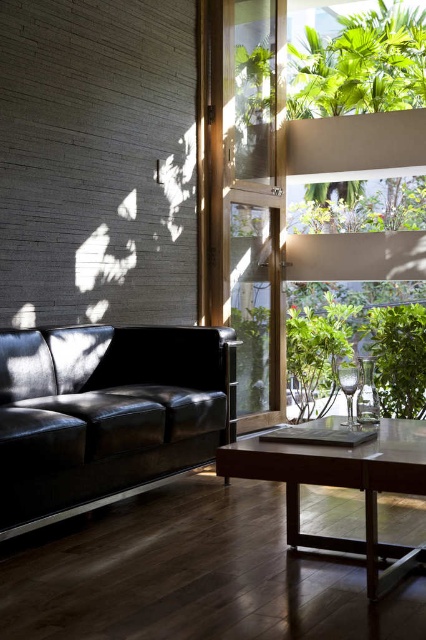
Can you confirm if glossy wood table at center is smaller than green leafy plant at right?

Actually, glossy wood table at center might be larger than green leafy plant at right.

This screenshot has height=640, width=426. What are the coordinates of `glossy wood table at center` in the screenshot? It's located at (344, 486).

Is point (394, 576) positioned after point (377, 310)?

No, (394, 576) is closer to viewer.

The image size is (426, 640). I want to click on glossy wood table at center, so click(344, 486).

Is matte black leather couch at left positioned at the back of green leafy plant at right?

No, matte black leather couch at left is closer to the viewer.

Does matte black leather couch at left appear over green leafy plant at right?

Yes.

Who is more forward, (80,464) or (402,316)?

Point (80,464)

The image size is (426, 640). What are the coordinates of `matte black leather couch at left` in the screenshot? It's located at (106, 413).

Consider the image. Can you confirm if green leafy plant at center is wider than green leafy plant at right?

Correct, the width of green leafy plant at center exceeds that of green leafy plant at right.

Does point (305, 392) come closer to viewer compared to point (386, 364)?

That is False.

Where is `green leafy plant at center`? green leafy plant at center is located at coordinates (316, 353).